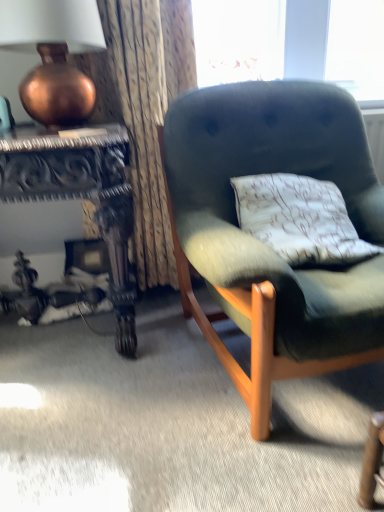
Question: From a real-world perspective, is velvet green armchair at center positioned above or below textured fabric curtain at upper left?

Choices:
 (A) below
 (B) above

Answer: (A)

Question: Is velvet green armchair at center bigger or smaller than textured fabric curtain at upper left?

Choices:
 (A) small
 (B) big

Answer: (B)

Question: Considering the real-world distances, which object is farthest from the carved wood desk at left?

Choices:
 (A) copper metallic vase at upper left
 (B) velvet green armchair at center
 (C) textured fabric curtain at upper left

Answer: (B)

Question: Which is farther from the copper metallic vase at upper left?

Choices:
 (A) textured fabric curtain at upper left
 (B) carved wood desk at left
 (C) velvet green armchair at center

Answer: (C)